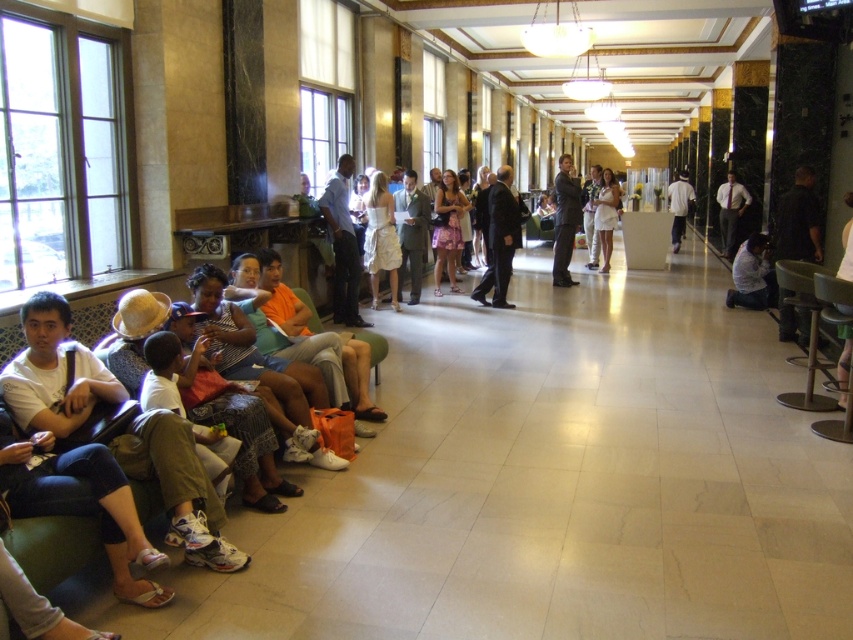
You are a photographer taking a portrait in the hall. You notice a dark gray suit at center and a white matte shirt at center. Which clothing item is positioned lower in the frame?

The dark gray suit at center is located below the white matte shirt at center, so the dark gray suit at center is positioned lower in the frame.

You are a photographer standing in the lobby and want to take a photo of both the dark gray suit at center and the white matte shirt at center in the same frame. The camera you are using has a maximum focus range of 4 meters. Can you capture both subjects in focus without moving your position?

The dark gray suit at center and white matte shirt at center are 4.65 meters apart, which exceeds the camera maximum focus range of 4 meters. Therefore, you cannot capture both subjects in focus without moving your position.

You are standing at the entrance of the hall and see two people wearing a light blue shirt at center and a white cotton shirt at center. If you want to greet both of them, which direction should you walk to first reach the closer one?

The light blue shirt at center is 5.01 meters away from white cotton shirt at center. Since you are at the entrance, the closer one would depend on their positions relative to the entrance. However, based on the given information, both are at the center, so you can walk straight towards the center to reach both equally.